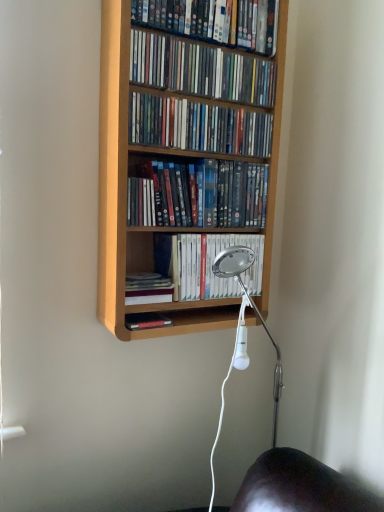
Locate an element on the screen. vacant point above white glossy book at center, acting as the second book starting from the bottom (from a real-world perspective) is located at coordinates (224, 231).